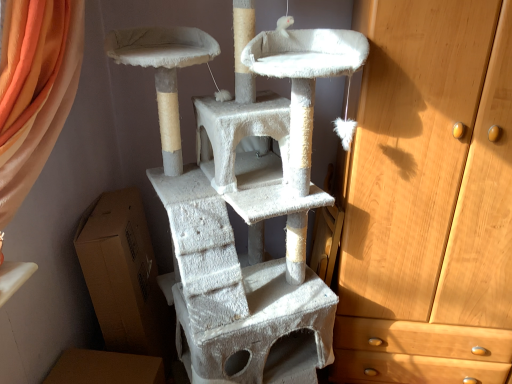
Question: Can you confirm if white textured cat tree at center is thinner than brown cardboard box at lower left?

Choices:
 (A) yes
 (B) no

Answer: (B)

Question: Is white textured cat tree at center far away from brown cardboard box at lower left?

Choices:
 (A) no
 (B) yes

Answer: (A)

Question: Considering the relative sizes of white textured cat tree at center and brown cardboard box at lower left in the image provided, is white textured cat tree at center wider than brown cardboard box at lower left?

Choices:
 (A) no
 (B) yes

Answer: (B)

Question: Considering the relative sizes of white textured cat tree at center and brown cardboard box at lower left in the image provided, is white textured cat tree at center taller than brown cardboard box at lower left?

Choices:
 (A) no
 (B) yes

Answer: (B)

Question: From a real-world perspective, is white textured cat tree at center beneath brown cardboard box at lower left?

Choices:
 (A) yes
 (B) no

Answer: (B)

Question: In terms of width, does white textured cat tree at center look wider or thinner when compared to brown cardboard box at lower left?

Choices:
 (A) thin
 (B) wide

Answer: (B)

Question: In the image, is white textured cat tree at center on the left side or the right side of brown cardboard box at lower left?

Choices:
 (A) left
 (B) right

Answer: (B)

Question: From a real-world perspective, is white textured cat tree at center positioned above or below brown cardboard box at lower left?

Choices:
 (A) above
 (B) below

Answer: (A)

Question: Based on their sizes in the image, would you say white textured cat tree at center is bigger or smaller than brown cardboard box at lower left?

Choices:
 (A) big
 (B) small

Answer: (A)

Question: Is brown cardboard box at lower left wider or thinner than light brown wooden chest of drawers at right?

Choices:
 (A) wide
 (B) thin

Answer: (B)

Question: From their relative heights in the image, would you say brown cardboard box at lower left is taller or shorter than light brown wooden chest of drawers at right?

Choices:
 (A) tall
 (B) short

Answer: (B)

Question: Would you say brown cardboard box at lower left is inside or outside light brown wooden chest of drawers at right?

Choices:
 (A) outside
 (B) inside

Answer: (A)

Question: From the image's perspective, relative to light brown wooden chest of drawers at right, is brown cardboard box at lower left above or below?

Choices:
 (A) above
 (B) below

Answer: (B)

Question: From the image's perspective, is light brown wooden chest of drawers at right above or below brown cardboard box at lower left?

Choices:
 (A) below
 (B) above

Answer: (B)

Question: Considering the positions of light brown wooden chest of drawers at right and brown cardboard box at lower left in the image, is light brown wooden chest of drawers at right taller or shorter than brown cardboard box at lower left?

Choices:
 (A) tall
 (B) short

Answer: (A)